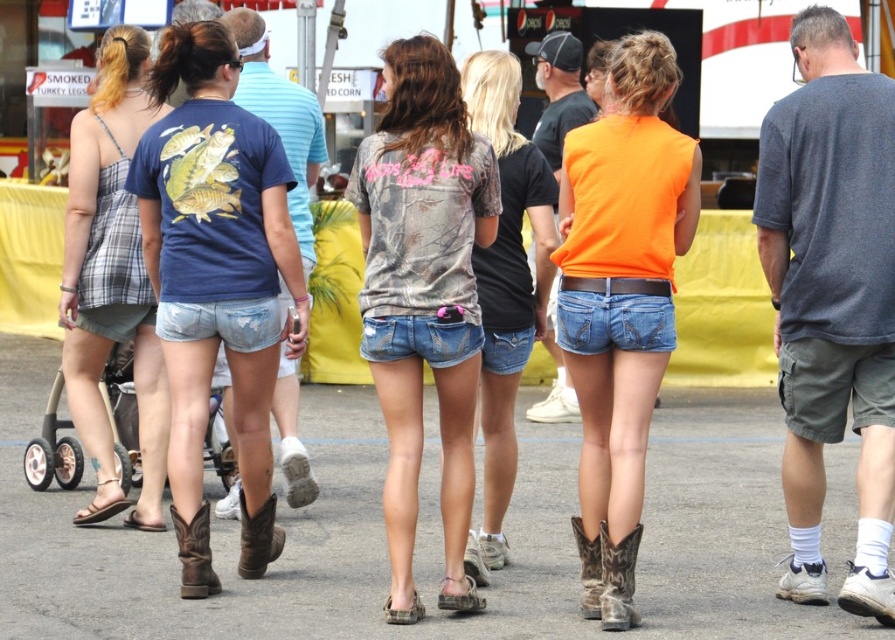
This screenshot has width=895, height=640. I want to click on brown leather boots at lower left, so click(216, 253).

Can you confirm if brown leather boots at lower left is positioned to the right of plaid fabric dress at left?

Yes, brown leather boots at lower left is to the right of plaid fabric dress at left.

The image size is (895, 640). I want to click on brown leather boots at lower left, so click(216, 253).

Does orange matte tank top at center have a greater width compared to brown leather cowboy boot at lower center?

Correct, the width of orange matte tank top at center exceeds that of brown leather cowboy boot at lower center.

How far apart are orange matte tank top at center and brown leather cowboy boot at lower center?

orange matte tank top at center is 26.74 inches from brown leather cowboy boot at lower center.

Is point (580, 468) farther from viewer compared to point (570, 518)?

No.

You are a GUI agent. You are given a task and a screenshot of the screen. Output one action in this format:
    pyautogui.click(x=<x>, y=<y>)
    Task: Click on the orange matte tank top at center
    This screenshot has width=895, height=640.
    Given the screenshot: What is the action you would take?
    click(621, 291)

Is point (121, 280) positioned in front of point (620, 584)?

No.

In the scene shown: Which of these two, plaid fabric dress at left or brown leather boot at lower center, stands taller?

plaid fabric dress at left

Image resolution: width=895 pixels, height=640 pixels. Find the location of `plaid fabric dress at left`. plaid fabric dress at left is located at coordinates (111, 278).

Image resolution: width=895 pixels, height=640 pixels. I want to click on plaid fabric dress at left, so [111, 278].